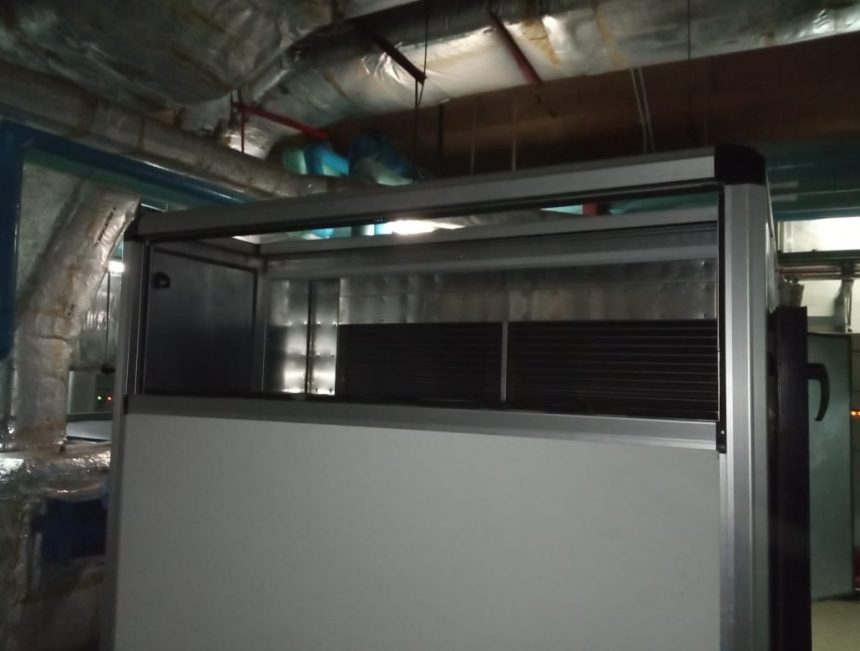
The width and height of the screenshot is (860, 651). In order to click on black door in this screenshot , I will do `click(806, 582)`.